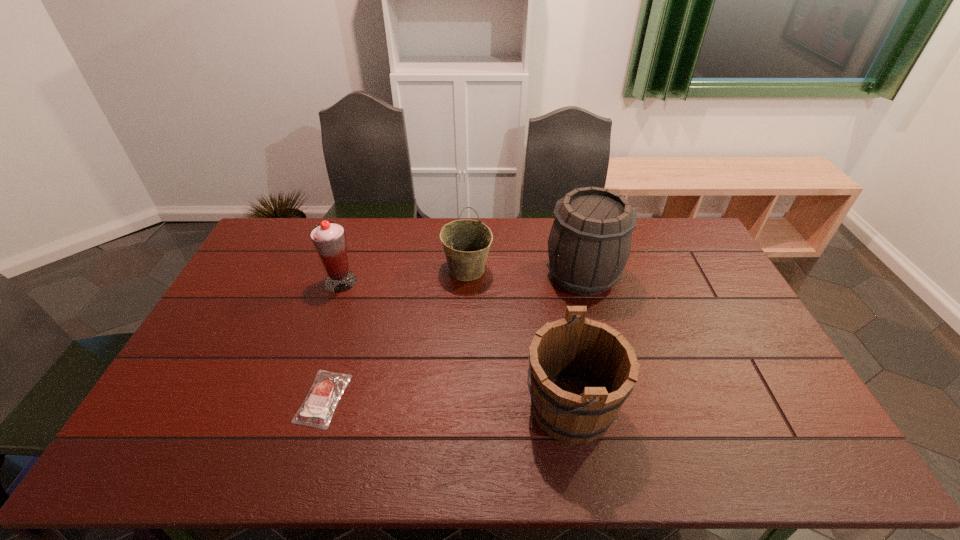
What are the coordinates of `free spot between the third object from left to right and the steak` in the screenshot? It's located at (396, 334).

Identify the location of the second closest object to the nearest wine bucket. (466, 243).

The height and width of the screenshot is (540, 960). What are the coordinates of `the fourth closest object relative to the nearest wine bucket` in the screenshot? It's located at (329, 239).

Find the location of a particular element. the second closest wine bucket relative to the leftmost wine bucket is located at coordinates (581, 371).

Identify which wine bucket is the nearest to the leftmost wine bucket. Please provide its 2D coordinates. Your answer should be formatted as a tuple, i.e. [(x, y)], where the tuple contains the x and y coordinates of a point satisfying the conditions above.

[(589, 245)]

This screenshot has height=540, width=960. What are the coordinates of `vacant space that satisfies the following two spatial constraints: 1. on the front side of the smoothie; 2. on the right side of the shortest object` in the screenshot? It's located at (300, 399).

This screenshot has height=540, width=960. Identify the location of vacant space that satisfies the following two spatial constraints: 1. on the back side of the shortest object; 2. on the left side of the third object from right to left. (362, 270).